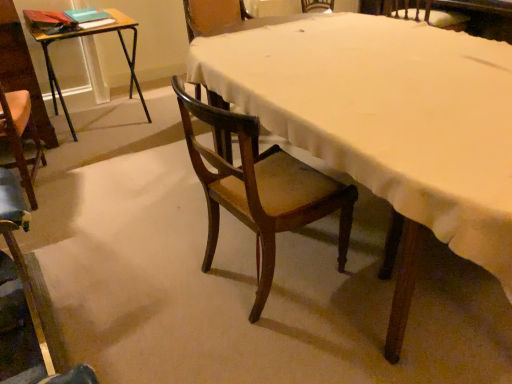
Where is `vacant space in wooden desk at left (from a real-world perspective)`? The width and height of the screenshot is (512, 384). vacant space in wooden desk at left (from a real-world perspective) is located at coordinates (101, 127).